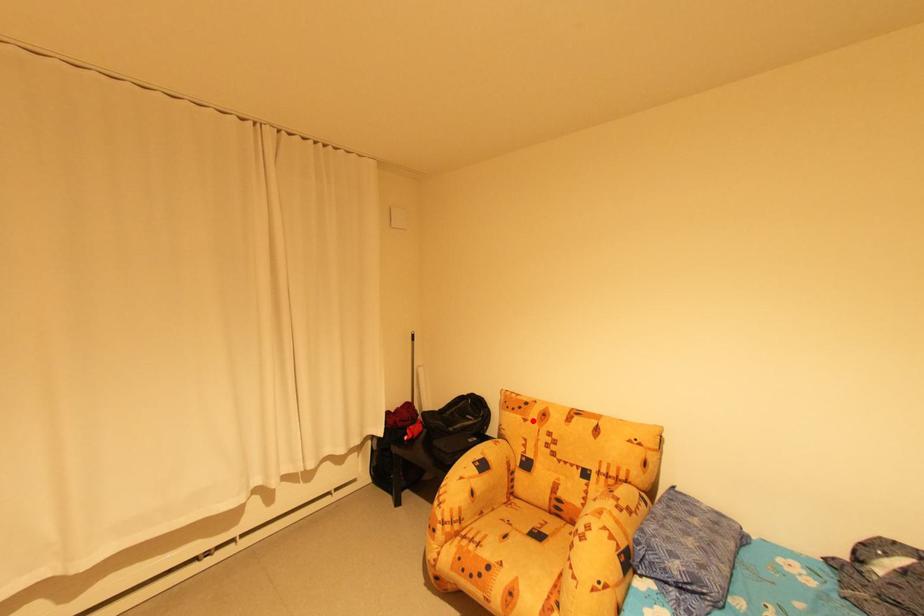
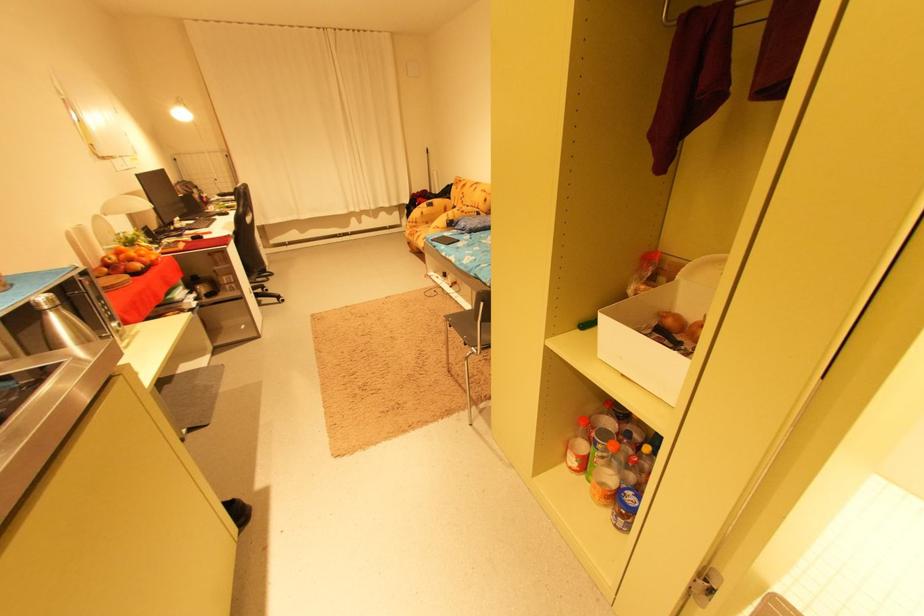
Question: I am providing you with two images of the same scene from different viewpoints. Given a red point in image1, look at the same physical point in image2. Is it:

Choices:
 (A) Closer to the viewpoint
 (B) Farther from the viewpoint

Answer: (A)